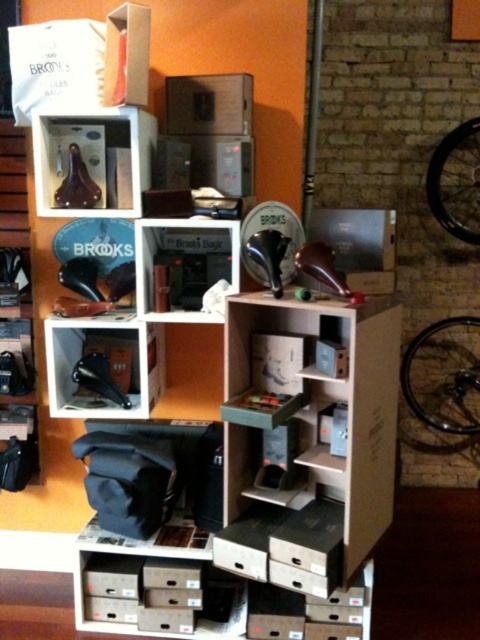
You are a customer in the store and want to pick up the matte black saddle at lower left. You are currently standing in front of the wooden at center. Which direction should you move to reach the saddle?

The wooden at center is to the right of the matte black saddle at lower left, so you should move to your left to reach the saddle.

You are a customer in the store and want to place the silver metallic bicycle wheel at right next to the matte black brooks saddle at center on a shelf. Based on their widths, will the wheel fit next to the saddle without overlapping?

The silver metallic bicycle wheel at right has a lesser width compared to matte black brooks saddle at center. Therefore, the wheel will fit next to the saddle without overlapping since it is narrower.

You are a customer in the store and want to pick up the matte black brooks saddle at center. However, there is a silver metallic bicycle wheel at right blocking your path. Can you reach the saddle without moving the wheel?

The silver metallic bicycle wheel at right is further to the viewer than the matte black brooks saddle at center, so it is closer to you. This means the wheel is in front of the saddle, blocking your path. To reach the saddle, you would need to move the wheel out of the way.